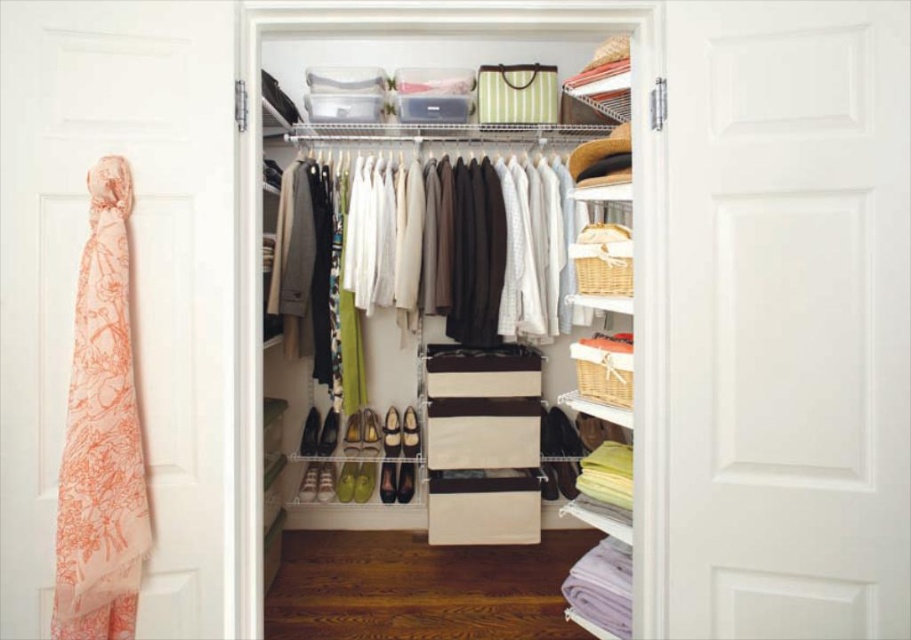
You have two scarves in your walk in closet, a peach silk scarf at left and a peach floral scarf at left. You want to fold them and place them into a storage box that can only fit items up to the size of the smaller scarf. Which scarf should you fold first to ensure it fits?

The peach silk scarf at left is larger than the peach floral scarf at left, so you should fold the peach silk scarf at left first to ensure it can fit into the storage box designed for the smaller size.

You are organizing a closet and see two scarves, the peach silk scarf at left and the peach floral scarf at left. Which one is positioned more to the left?

The peach silk scarf at left is positioned more to the left than the peach floral scarf at left according to the description.